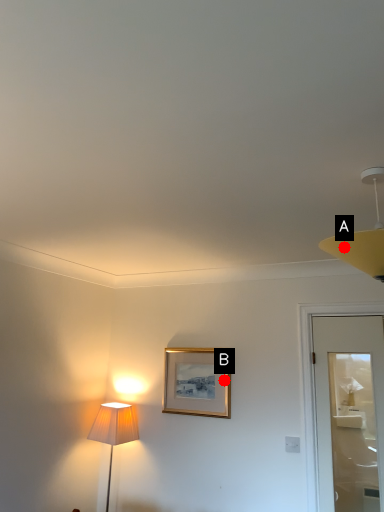
Question: Two points are circled on the image, labeled by A and B beside each circle. Which point is closer to the camera?

Choices:
 (A) A is closer
 (B) B is closer

Answer: (A)